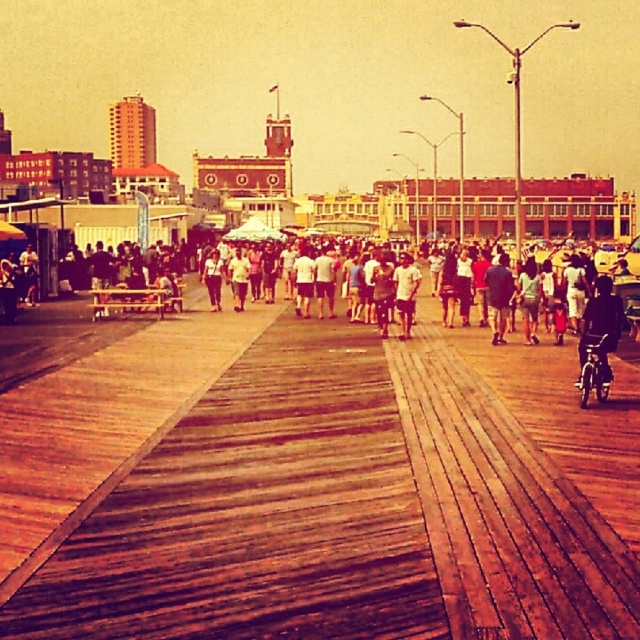
Question: Which point appears farthest from the camera in this image?

Choices:
 (A) 596,355
 (B) 500,278
 (C) 282,624
 (D) 408,324

Answer: (D)

Question: Does wooden at center appear on the right side of dark blue jeans at center?

Choices:
 (A) no
 (B) yes

Answer: (A)

Question: Considering the relative positions of dark matte jacket at center-right and dark blue jeans at center in the image provided, where is dark matte jacket at center-right located with respect to dark blue jeans at center?

Choices:
 (A) below
 (B) above

Answer: (A)

Question: Which point is farther to the camera?

Choices:
 (A) tap(433, 580)
 (B) tap(490, 301)

Answer: (B)

Question: Observing the image, what is the correct spatial positioning of wooden at center in reference to light brown leather jacket at center?

Choices:
 (A) above
 (B) below

Answer: (B)

Question: Which point is farther to the camera?

Choices:
 (A) dark matte jacket at center-right
 (B) dark blue jeans at center

Answer: (B)